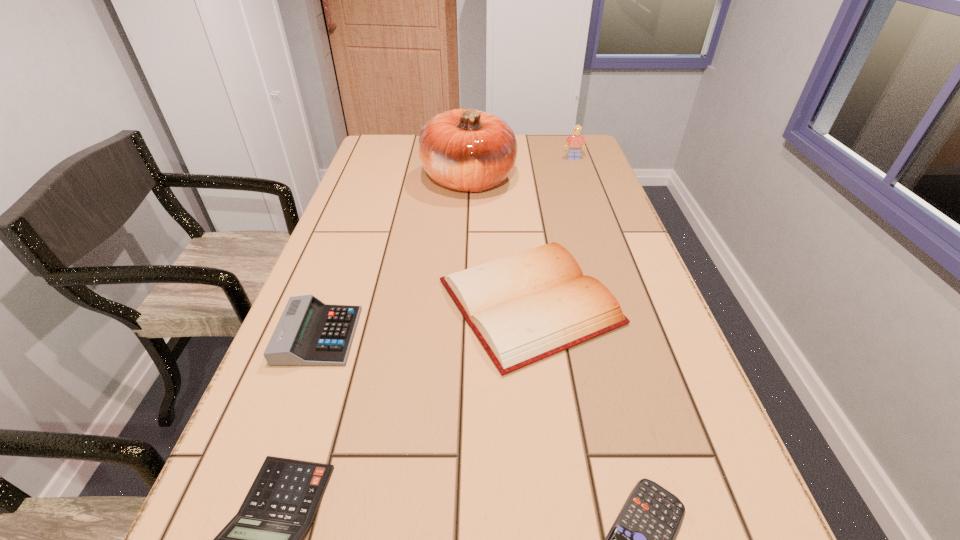
Image resolution: width=960 pixels, height=540 pixels. What are the coordinates of `the tallest object` in the screenshot? It's located at (469, 150).

I want to click on the second tallest object, so click(x=576, y=141).

Locate an element on the screen. This screenshot has height=540, width=960. Bible is located at coordinates (525, 307).

This screenshot has width=960, height=540. Find the location of `the farthest calculator`. the farthest calculator is located at coordinates (309, 333).

I want to click on free spot located on the left of the pumpkin, so click(x=369, y=180).

The width and height of the screenshot is (960, 540). What are the coordinates of `free point located on the front-facing side of the Lego` in the screenshot? It's located at (585, 190).

Locate an element on the screen. This screenshot has width=960, height=540. vacant area situated on the left of the Bible is located at coordinates (325, 302).

The width and height of the screenshot is (960, 540). What are the coordinates of `free space located 0.280m on the right of the tallest calculator` in the screenshot? It's located at (497, 336).

The image size is (960, 540). In order to click on pumpkin located in the far edge section of the desktop in this screenshot , I will do `click(469, 150)`.

The height and width of the screenshot is (540, 960). Find the location of `Lego that is at the far edge`. Lego that is at the far edge is located at coordinates (576, 141).